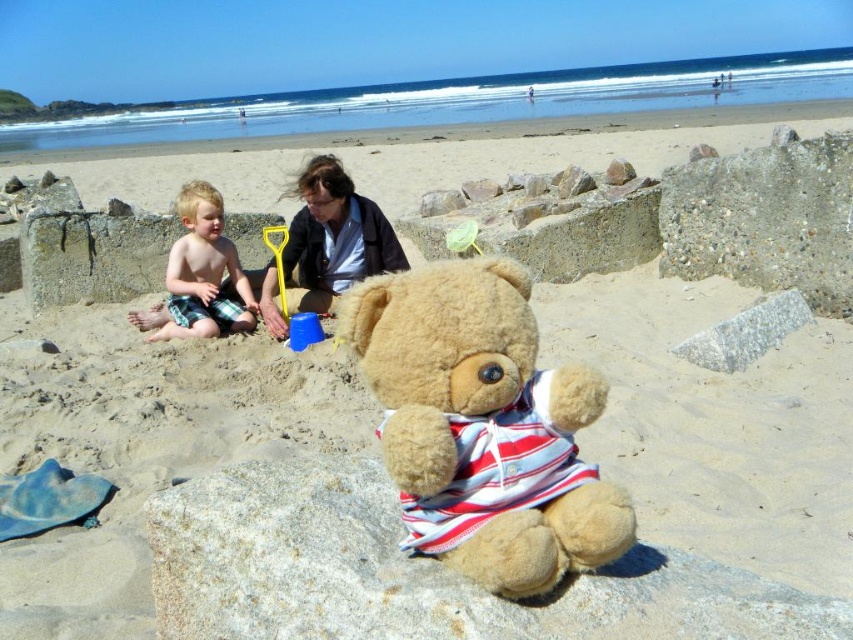
Question: Among these points, which one is farthest from the camera?

Choices:
 (A) (682, 602)
 (B) (213, 301)
 (C) (338, 272)

Answer: (C)

Question: Does smooth brown hair at center have a larger size compared to blonde hair boy at left?

Choices:
 (A) no
 (B) yes

Answer: (B)

Question: Is gray rough stone at center wider than blonde hair boy at left?

Choices:
 (A) yes
 (B) no

Answer: (A)

Question: Which is farther from the fuzzy brown teddy bear at center?

Choices:
 (A) smooth brown hair at center
 (B) gray rough stone at center

Answer: (A)

Question: Estimate the real-world distances between objects in this image. Which object is closer to the blonde hair boy at left?

Choices:
 (A) fuzzy brown teddy bear at center
 (B) gray rough stone at center
 (C) smooth brown hair at center

Answer: (C)

Question: Is gray rough stone at center wider than fuzzy brown teddy bear at center?

Choices:
 (A) yes
 (B) no

Answer: (A)